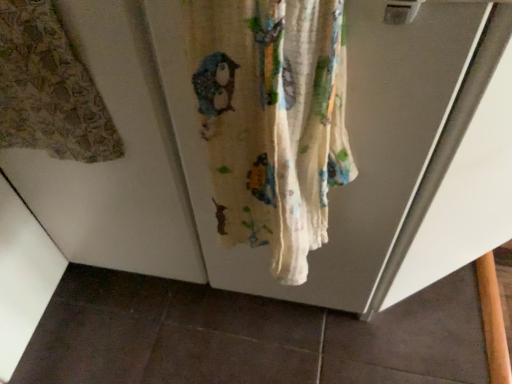
Question: Can printed fabric curtain at left, which is the 1th curtain in left-to-right order, be found inside white cotton curtain at center, marked as the 2th curtain in a left-to-right arrangement?

Choices:
 (A) no
 (B) yes

Answer: (A)

Question: From the image's perspective, is white cotton curtain at center, placed as the 1th curtain when sorted from right to left, located above printed fabric curtain at left, which is the 1th curtain in left-to-right order?

Choices:
 (A) yes
 (B) no

Answer: (B)

Question: Does white cotton curtain at center, placed as the 1th curtain when sorted from right to left, appear on the right side of printed fabric curtain at left, which is the 1th curtain in left-to-right order?

Choices:
 (A) yes
 (B) no

Answer: (A)

Question: Is white cotton curtain at center, placed as the 1th curtain when sorted from right to left, positioned behind printed fabric curtain at left, which is the 1th curtain in left-to-right order?

Choices:
 (A) no
 (B) yes

Answer: (A)

Question: Is white cotton curtain at center, placed as the 1th curtain when sorted from right to left, not close to printed fabric curtain at left, the second curtain from the right?

Choices:
 (A) yes
 (B) no

Answer: (B)

Question: Can we say white cotton curtain at center, placed as the 1th curtain when sorted from right to left, lies outside printed fabric curtain at left, the second curtain from the right?

Choices:
 (A) no
 (B) yes

Answer: (B)

Question: Is printed fabric curtain at left, the second curtain from the right, smaller than white cotton curtain at center, placed as the 1th curtain when sorted from right to left?

Choices:
 (A) yes
 (B) no

Answer: (A)

Question: Can you confirm if printed fabric curtain at left, which is the 1th curtain in left-to-right order, is taller than white cotton curtain at center, marked as the 2th curtain in a left-to-right arrangement?

Choices:
 (A) yes
 (B) no

Answer: (A)

Question: Is printed fabric curtain at left, which is the 1th curtain in left-to-right order, located outside white cotton curtain at center, marked as the 2th curtain in a left-to-right arrangement?

Choices:
 (A) no
 (B) yes

Answer: (B)

Question: Is printed fabric curtain at left, the second curtain from the right, aimed at white cotton curtain at center, placed as the 1th curtain when sorted from right to left?

Choices:
 (A) no
 (B) yes

Answer: (A)

Question: Considering the relative sizes of printed fabric curtain at left, the second curtain from the right, and white cotton curtain at center, placed as the 1th curtain when sorted from right to left, in the image provided, is printed fabric curtain at left, the second curtain from the right, shorter than white cotton curtain at center, placed as the 1th curtain when sorted from right to left,?

Choices:
 (A) yes
 (B) no

Answer: (B)

Question: Can you confirm if printed fabric curtain at left, which is the 1th curtain in left-to-right order, is bigger than white cotton curtain at center, placed as the 1th curtain when sorted from right to left?

Choices:
 (A) yes
 (B) no

Answer: (B)

Question: From the image's perspective, is white cotton curtain at center, marked as the 2th curtain in a left-to-right arrangement, positioned above or below printed fabric curtain at left, which is the 1th curtain in left-to-right order?

Choices:
 (A) below
 (B) above

Answer: (A)